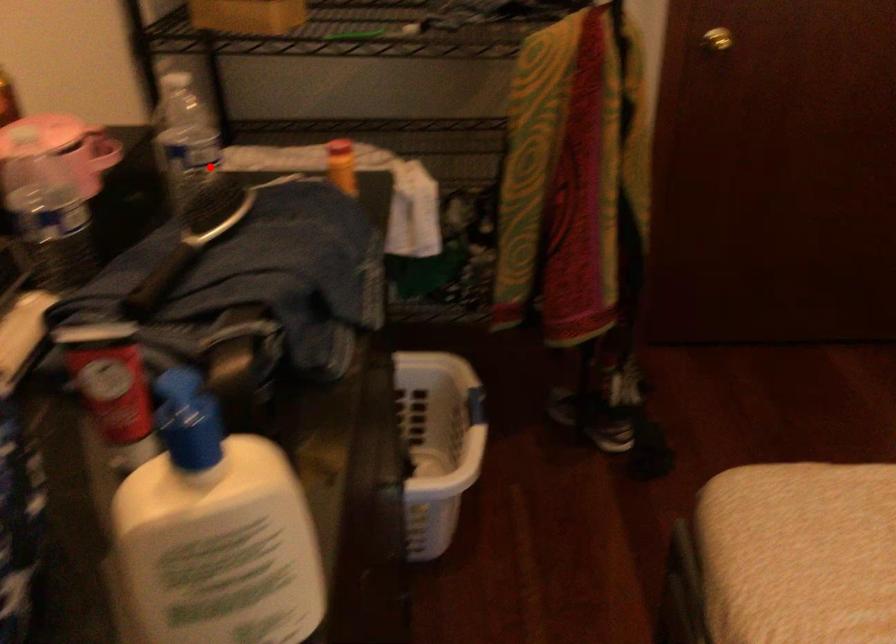
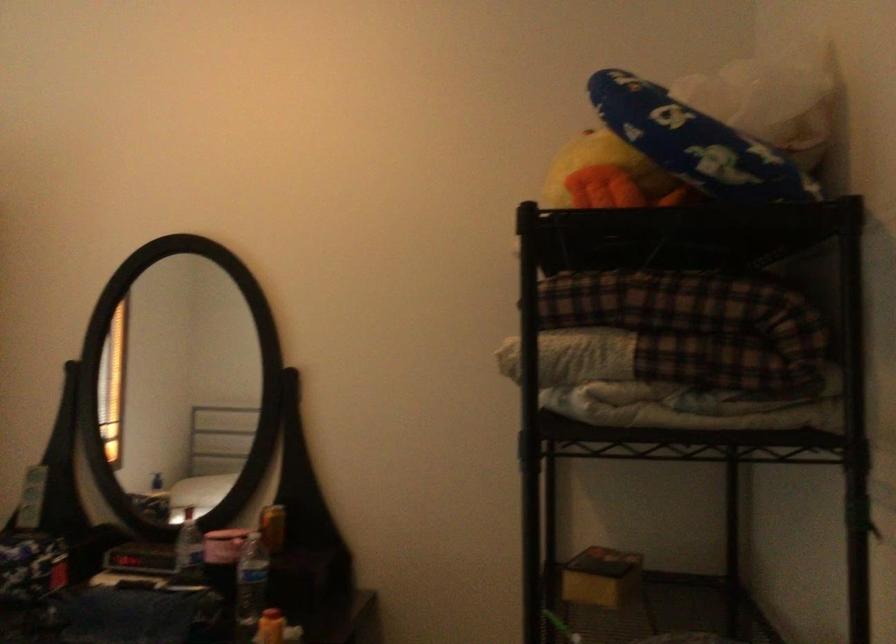
Question: I am providing you with two images of the same scene from different viewpoints. In image1, a red point is highlighted. Considering the same 3D point in image2, which of the following is correct?

Choices:
 (A) It is closer
 (B) It is farther

Answer: (B)